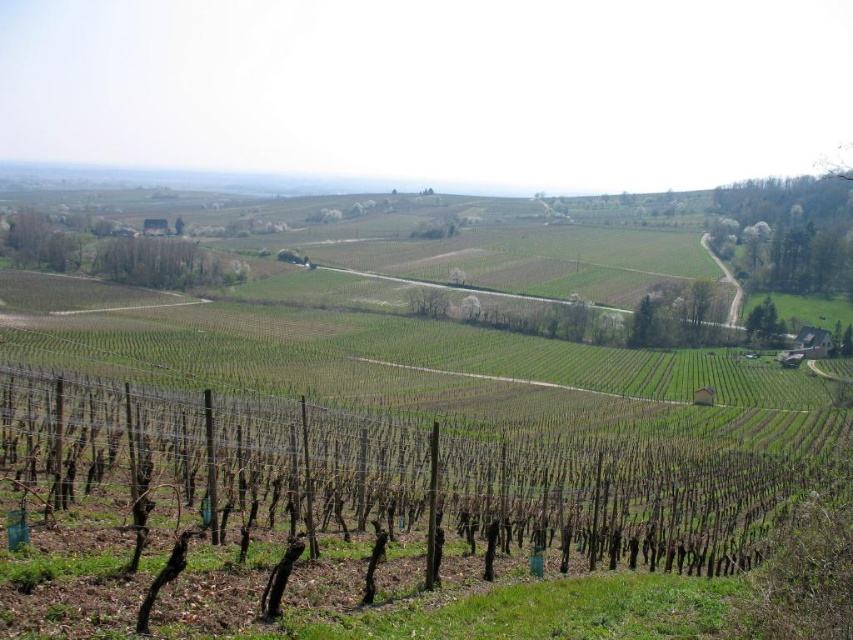
Identify the location of green leafy tree at upper right. (788, 232).

Between green leafy tree at upper right and green leafy tree at lower right, which one appears on the left side from the viewer's perspective?

green leafy tree at lower right

Where is `green leafy tree at upper right`? This screenshot has height=640, width=853. green leafy tree at upper right is located at coordinates (788, 232).

Can you confirm if green leafy tree at upper right is bigger than green leafy trees at upper left?

Indeed, green leafy tree at upper right has a larger size compared to green leafy trees at upper left.

Who is more forward, (750,220) or (161,273)?

Point (161,273) is in front.

The height and width of the screenshot is (640, 853). Describe the element at coordinates (788, 232) in the screenshot. I see `green leafy tree at upper right` at that location.

At what (x,y) coordinates should I click in order to perform the action: click on green leafy tree at upper right. Please return your answer as a coordinate pair (x, y). This screenshot has width=853, height=640. Looking at the image, I should click on (788, 232).

Is point (138, 246) farther from viewer compared to point (752, 330)?

Yes, point (138, 246) is farther from viewer.

Looking at this image, is green leafy trees at upper left to the right of green leafy tree at lower right from the viewer's perspective?

Incorrect, green leafy trees at upper left is not on the right side of green leafy tree at lower right.

Between point (213, 257) and point (766, 307), which one is positioned in front?

Point (766, 307) is in front.

Locate an element on the screen. Image resolution: width=853 pixels, height=640 pixels. green leafy trees at upper left is located at coordinates (164, 262).